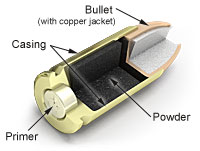
Locate an element on the screen. casing is located at coordinates (97, 43), (116, 99).